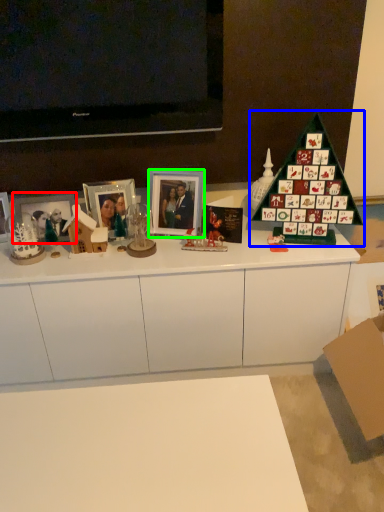
Question: Which object is positioned closest to picture frame (highlighted by a red box)? Select from christmas tree (highlighted by a blue box) and picture frame (highlighted by a green box).

Choices:
 (A) christmas tree
 (B) picture frame

Answer: (B)